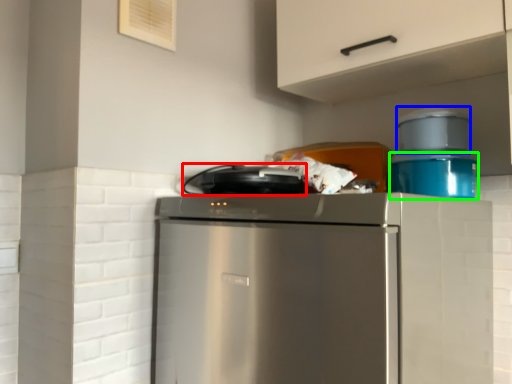
Question: Which object is positioned closest to appliance (highlighted by a red box)? Select from appliance (highlighted by a blue box) and appliance (highlighted by a green box).

Choices:
 (A) appliance
 (B) appliance

Answer: (B)